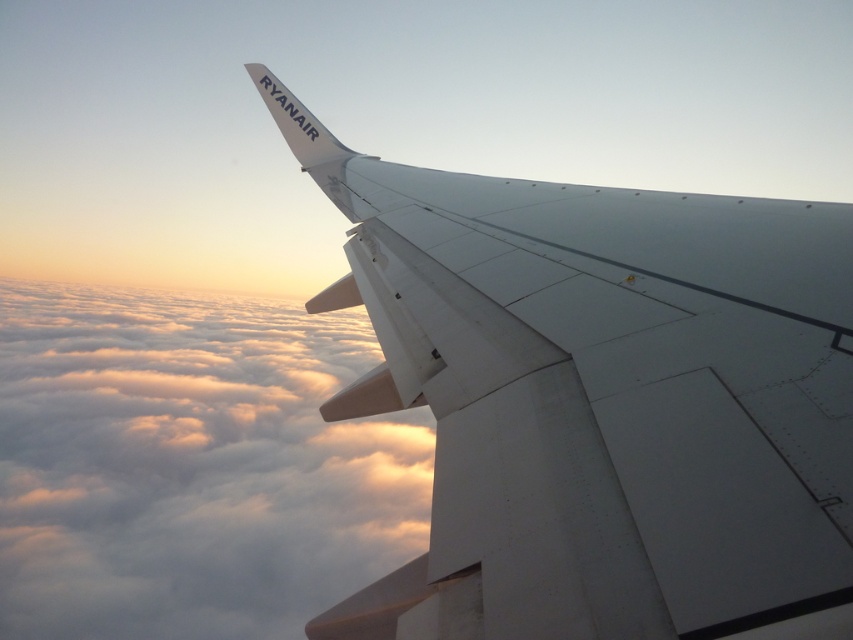
Measure the distance from white matte wing at upper center to white fluffy cloud at upper center.

A distance of 532.52 meters exists between white matte wing at upper center and white fluffy cloud at upper center.

This screenshot has width=853, height=640. What do you see at coordinates (601, 401) in the screenshot? I see `white matte wing at upper center` at bounding box center [601, 401].

This screenshot has width=853, height=640. I want to click on white matte wing at upper center, so click(x=601, y=401).